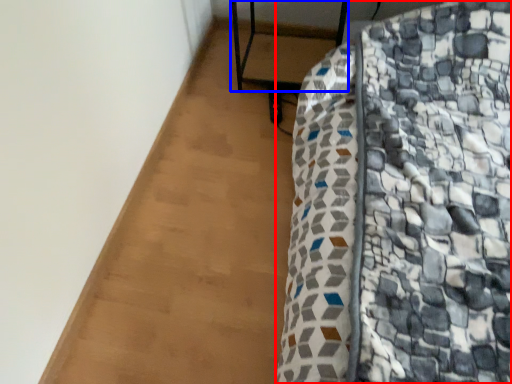
Question: Which point is further to the camera, furniture (highlighted by a red box) or furniture (highlighted by a blue box)?

Choices:
 (A) furniture
 (B) furniture

Answer: (B)